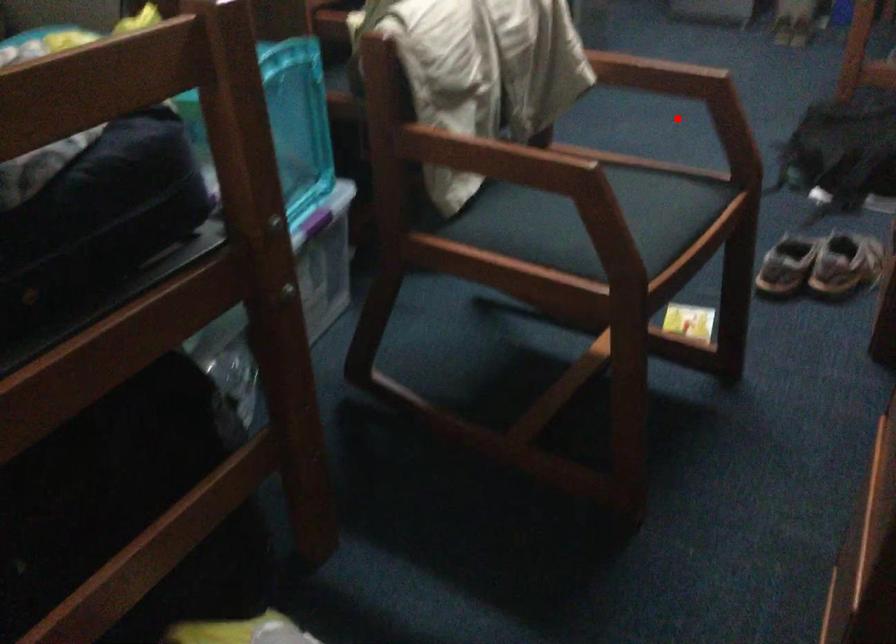
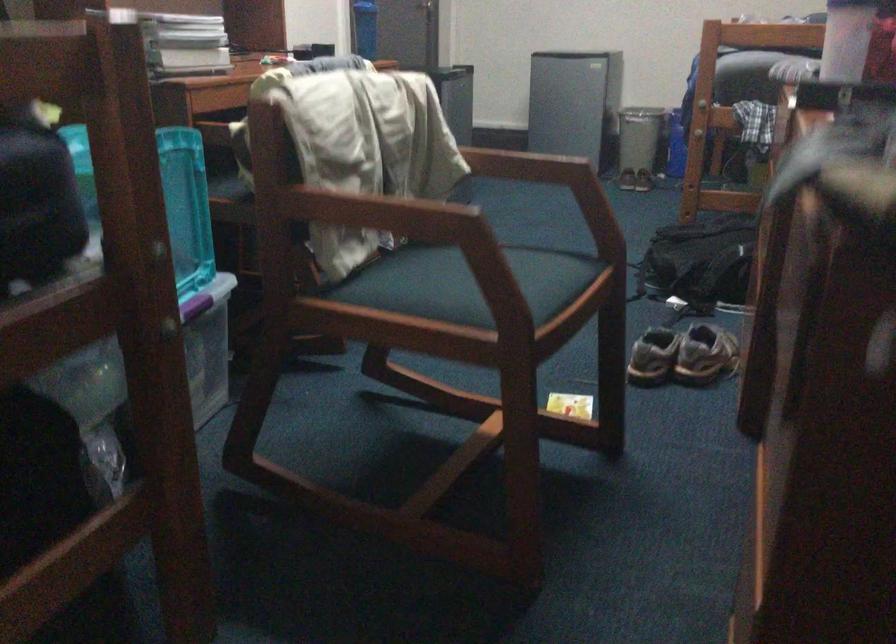
The point at the highlighted location is marked in the first image. Where is the corresponding point in the second image?

(543, 242)